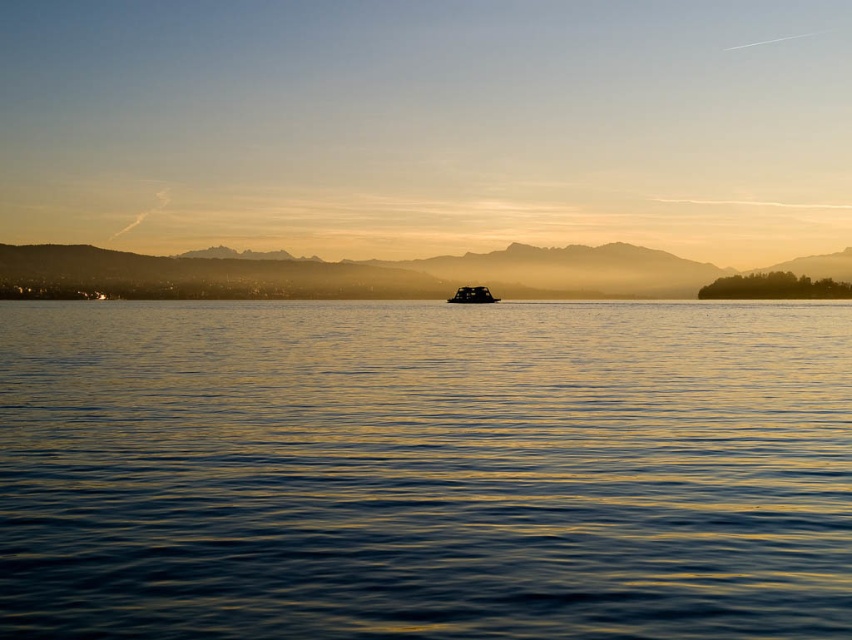
Question: Is blue water at center bigger than black rubber boat at center?

Choices:
 (A) no
 (B) yes

Answer: (B)

Question: Does blue water at center have a lesser width compared to black rubber boat at center?

Choices:
 (A) no
 (B) yes

Answer: (A)

Question: Among these points, which one is nearest to the camera?

Choices:
 (A) (117, 433)
 (B) (448, 300)

Answer: (A)

Question: Is blue water at center positioned before silvery metallic mountain at center?

Choices:
 (A) yes
 (B) no

Answer: (A)

Question: Considering the real-world distances, which object is closest to the blue water at center?

Choices:
 (A) black rubber boat at center
 (B) silvery metallic mountain at center

Answer: (A)

Question: Which object is positioned farthest from the blue water at center?

Choices:
 (A) black rubber boat at center
 (B) silvery metallic mountain at center

Answer: (B)